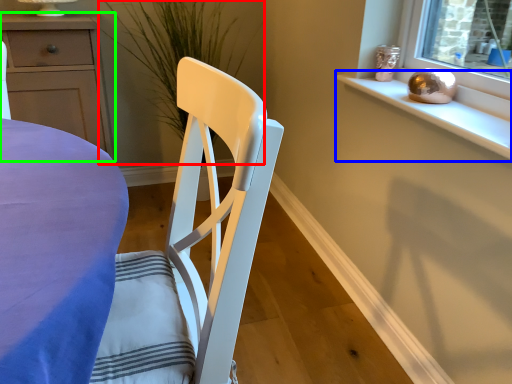
Question: Which object is the farthest from plant (highlighted by a red box)? Choose among these: window sill (highlighted by a blue box) or cabinetry (highlighted by a green box).

Choices:
 (A) window sill
 (B) cabinetry

Answer: (A)